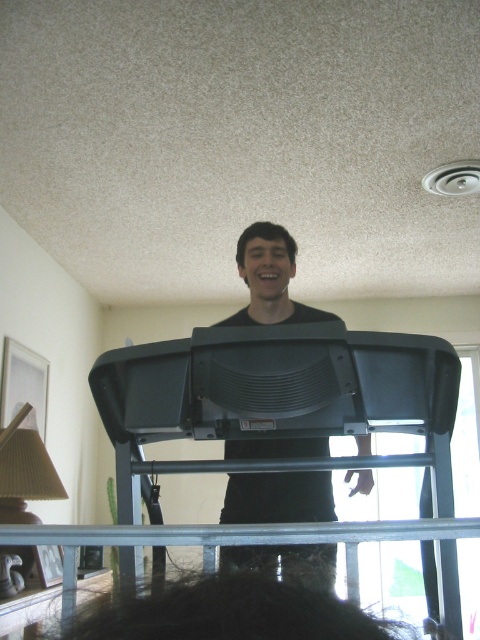
You are standing at the point marked as point (276, 397) in the image. What object is directly in front of you?

The black plastic ladder at center is directly in front of you at point (276, 397).

You are trying to reach a high shelf in your home. You see a black plastic ladder at center and a black matte treadmill at center. Which object should you use to safely reach the high shelf?

The black plastic ladder at center is taller than the black matte treadmill at center, so you should use the black plastic ladder at center to safely reach the high shelf.